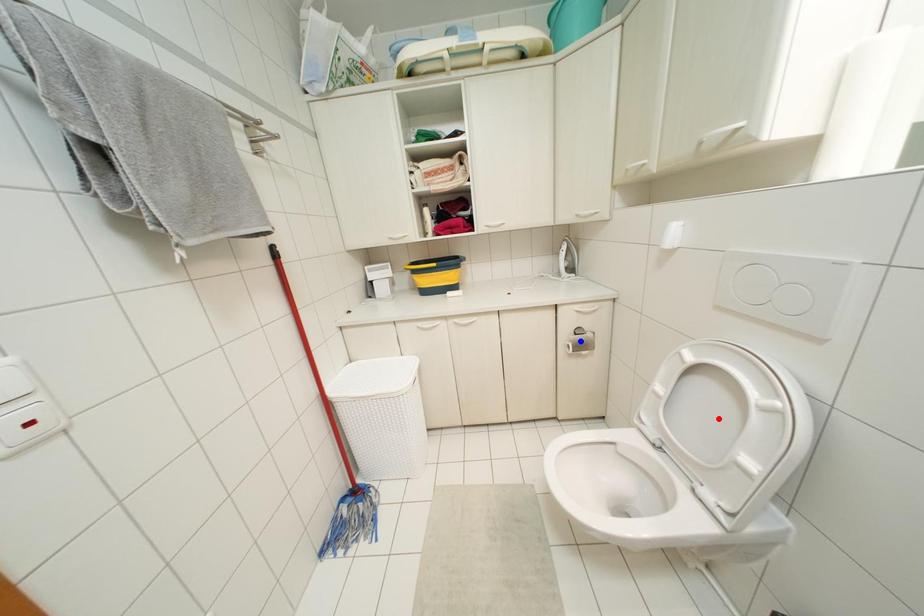
Question: Two points are marked on the image. Which point is closer to the camera?

Choices:
 (A) Blue point is closer.
 (B) Red point is closer.

Answer: (B)